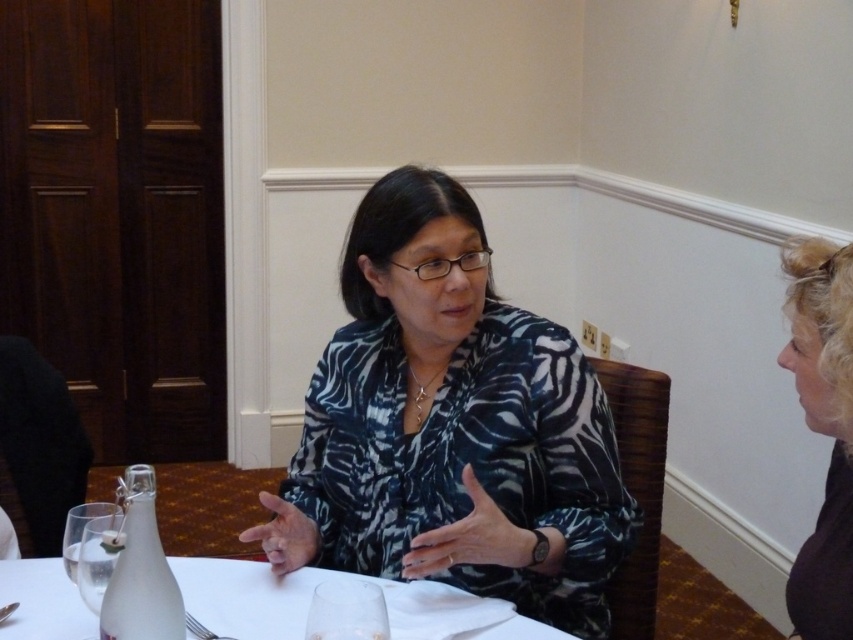
Question: Which object appears closest to the camera in this image?

Choices:
 (A) clear glass at center
 (B) clear glass wine glass at lower left
 (C) printed fabric blouse at center
 (D) white frosted glass at center

Answer: (A)

Question: Can you confirm if blonde hair at right is positioned to the left of white frosted glass at center?

Choices:
 (A) yes
 (B) no

Answer: (B)

Question: Among these points, which one is farthest from the camera?

Choices:
 (A) (457, 388)
 (B) (82, 572)
 (C) (788, 572)

Answer: (A)

Question: Is printed fabric blouse at center to the left of blonde hair at right from the viewer's perspective?

Choices:
 (A) no
 (B) yes

Answer: (B)

Question: Estimate the real-world distances between objects in this image. Which object is farther from the clear glass wine glass at lower left?

Choices:
 (A) clear glass at center
 (B) white frosted glass at center
 (C) blonde hair at right

Answer: (C)

Question: Is clear glass at center wider than clear glass wine glass at lower left?

Choices:
 (A) no
 (B) yes

Answer: (B)